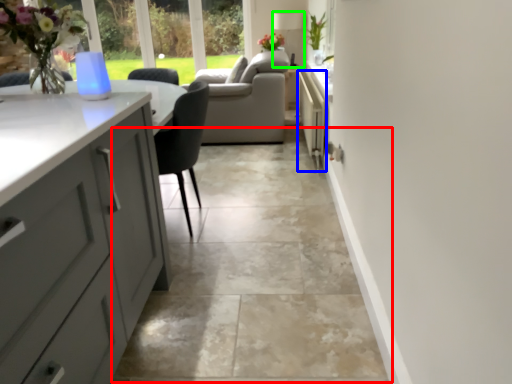
Question: Estimate the real-world distances between objects in this image. Which object is closer to path (highlighted by a red box), appliance (highlighted by a blue box) or lamp (highlighted by a green box)?

Choices:
 (A) appliance
 (B) lamp

Answer: (A)